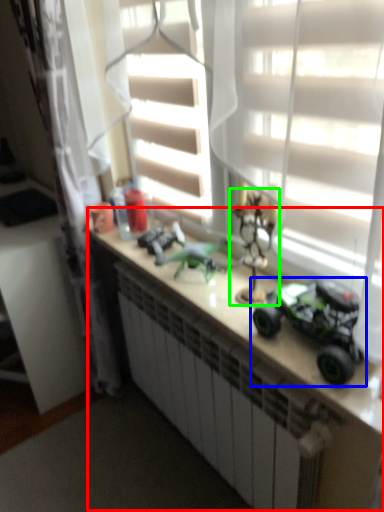
Question: Considering the real-world distances, which object is farthest from counter (highlighted by a red box)? toy (highlighted by a blue box) or toy (highlighted by a green box)?

Choices:
 (A) toy
 (B) toy

Answer: (B)